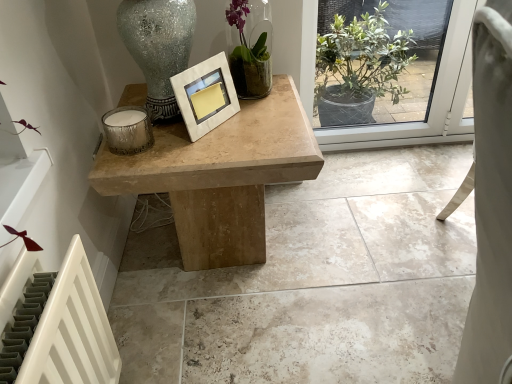
The width and height of the screenshot is (512, 384). What do you see at coordinates (220, 176) in the screenshot?
I see `natural wood table at center` at bounding box center [220, 176].

You are a GUI agent. You are given a task and a screenshot of the screen. Output one action in this format:
    pyautogui.click(x=<x>, y=<y>)
    Task: Click on the natural stone table at center
    This screenshot has height=384, width=512.
    Given the screenshot: What is the action you would take?
    pyautogui.click(x=314, y=283)

Image resolution: width=512 pixels, height=384 pixels. Find the location of `green glass vase at upper center`. green glass vase at upper center is located at coordinates point(250,54).

Is metallic textured candle at left at the right side of white marble picture frame at center?

No.

From a real-world perspective, is metallic textured candle at left located higher than white marble picture frame at center?

No, from a real-world perspective, metallic textured candle at left is not on top of white marble picture frame at center.

Is metallic textured candle at left aimed at white marble picture frame at center?

No, metallic textured candle at left does not turn towards white marble picture frame at center.

Is point (113, 128) behind point (224, 89)?

No, (113, 128) is in front of (224, 89).

Is metallic textured candle at left at the back of white marble picture frame at center?

white marble picture frame at center does not have its back to metallic textured candle at left.

How distant is white marble picture frame at center from metallic textured candle at left?

A distance of 6.92 inches exists between white marble picture frame at center and metallic textured candle at left.

Considering the positions of objects white marble picture frame at center and metallic textured candle at left in the image provided, who is behind, white marble picture frame at center or metallic textured candle at left?

metallic textured candle at left is further from the camera.

From the image's perspective, is white marble picture frame at center positioned above or below metallic textured candle at left?

white marble picture frame at center is situated higher than metallic textured candle at left in the image.

Considering the relative sizes of green glass vase at upper center and natural wood table at center in the image provided, is green glass vase at upper center wider than natural wood table at center?

Incorrect, the width of green glass vase at upper center does not surpass that of natural wood table at center.

Between point (259, 51) and point (92, 178), which one is positioned behind?

Point (259, 51)

Does green glass vase at upper center have a smaller size compared to natural wood table at center?

Yes.

Is the surface of green glass vase at upper center in direct contact with natural stone table at center?

green glass vase at upper center is not next to natural stone table at center, and they're not touching.

Consider the image. Visually, is green glass vase at upper center positioned to the left or to the right of natural stone table at center?

green glass vase at upper center is to the left of natural stone table at center.

Is point (257, 29) closer or farther from the camera than point (337, 241)?

Clearly, point (257, 29) is closer to the camera than point (337, 241).

Can you confirm if green glass vase at upper center is taller than natural stone table at center?

Yes, green glass vase at upper center is taller than natural stone table at center.

Which is more to the right, white marble picture frame at center or natural stone table at center?

natural stone table at center.

Is white marble picture frame at center oriented away from natural stone table at center?

No.

Can you confirm if white marble picture frame at center is smaller than natural stone table at center?

Correct, white marble picture frame at center occupies less space than natural stone table at center.

The image size is (512, 384). What are the coordinates of `candle holder above the natural stone table at center (from the image's perspective)` in the screenshot? It's located at (128, 130).

Is natural stone table at center turned away from metallic textured candle at left?

natural stone table at center does not have its back to metallic textured candle at left.

Considering the relative sizes of natural stone table at center and metallic textured candle at left in the image provided, is natural stone table at center thinner than metallic textured candle at left?

No, natural stone table at center is not thinner than metallic textured candle at left.

Between white marble picture frame at center and natural wood table at center, which one is positioned behind?

natural wood table at center is behind.

From a real-world perspective, who is located higher, white marble picture frame at center or natural wood table at center?

white marble picture frame at center.

Can you confirm if white marble picture frame at center is shorter than natural wood table at center?

Indeed, white marble picture frame at center has a lesser height compared to natural wood table at center.

Where is `candle holder below the white marble picture frame at center (from the image's perspective)`? This screenshot has width=512, height=384. candle holder below the white marble picture frame at center (from the image's perspective) is located at coordinates (128, 130).

The height and width of the screenshot is (384, 512). I want to click on candle holder behind the white marble picture frame at center, so click(128, 130).

Considering their positions, is natural wood table at center positioned further to natural stone table at center than metallic textured candle at left?

metallic textured candle at left is further to natural stone table at center.

Looking at the image, which one is located closer to metallic textured candle at left, natural wood table at center or green glass vase at upper center?

natural wood table at center lies closer to metallic textured candle at left than the other object.

Which object lies further to the anchor point natural stone table at center, white marble picture frame at center or green glass vase at upper center?

The object further to natural stone table at center is green glass vase at upper center.

From the image, which object appears to be farther from natural stone table at center, metallic textured candle at left or natural wood table at center?

Based on the image, metallic textured candle at left appears to be further to natural stone table at center.

Looking at the image, which one is located closer to green glass vase at upper center, natural stone table at center or white marble picture frame at center?

The object closer to green glass vase at upper center is white marble picture frame at center.

Considering their positions, is natural wood table at center positioned closer to natural stone table at center than green glass vase at upper center?

natural wood table at center lies closer to natural stone table at center than the other object.

In the scene shown: Estimate the real-world distances between objects in this image. Which object is closer to metallic textured candle at left, green glass vase at upper center or natural stone table at center?

green glass vase at upper center is closer to metallic textured candle at left.

Which object lies further to the anchor point white marble picture frame at center, natural stone table at center or green glass vase at upper center?

The object further to white marble picture frame at center is natural stone table at center.

This screenshot has width=512, height=384. What are the coordinates of `picture frame between green glass vase at upper center and natural wood table at center vertically` in the screenshot? It's located at (205, 95).

Where is `table between metallic textured candle at left and white marble picture frame at center from left to right`? The image size is (512, 384). table between metallic textured candle at left and white marble picture frame at center from left to right is located at coordinates pos(220,176).

The width and height of the screenshot is (512, 384). What are the coordinates of `table between metallic textured candle at left and natural stone table at center in the horizontal direction` in the screenshot? It's located at (220, 176).

Find the location of a particular element. The image size is (512, 384). candle holder that lies between green glass vase at upper center and natural stone table at center from top to bottom is located at coordinates (128, 130).